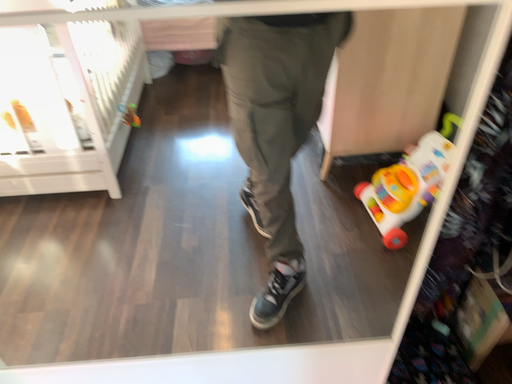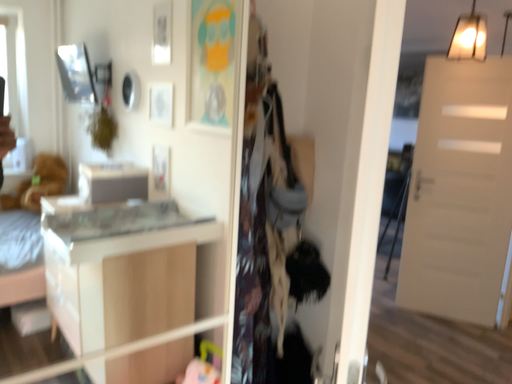
Question: How did the camera likely rotate when shooting the video?

Choices:
 (A) rotated upward
 (B) rotated downward

Answer: (A)